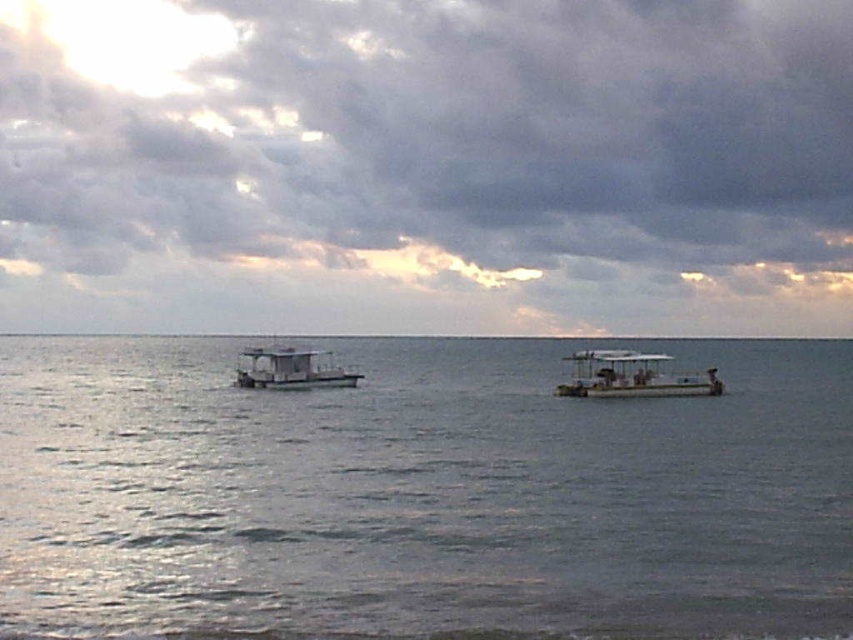
You are standing on the deck of a ship and looking towards the horizon. You notice the cloudy sky at upper center and the metallic gray boat at right. Which object is higher in the image?

The cloudy sky at upper center is located above the metallic gray boat at right, so it is higher in the image.